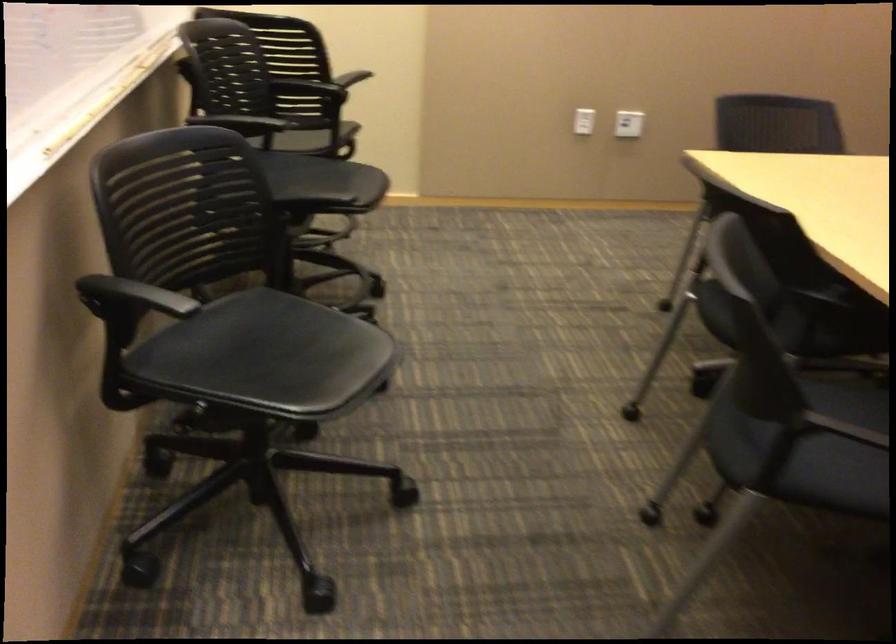
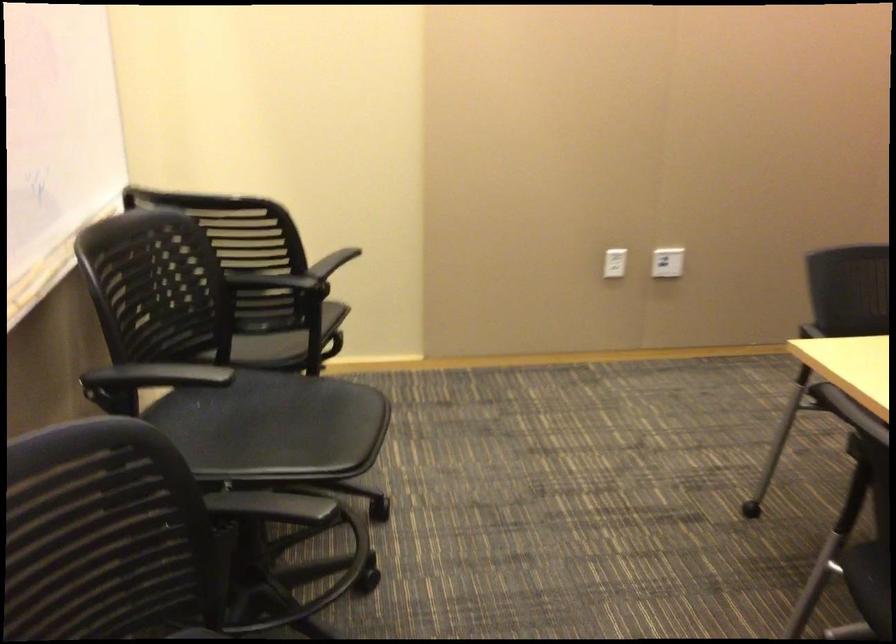
Find the pixel in the second image that matches point (634, 122) in the first image.

(667, 261)